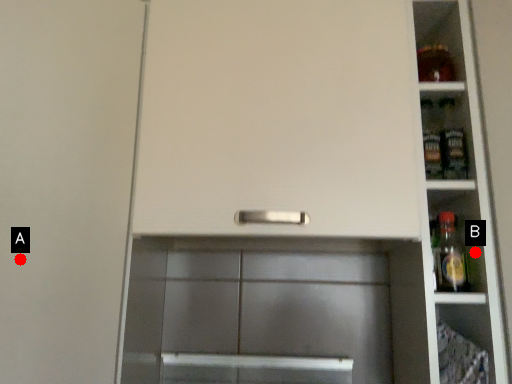
Question: Two points are circled on the image, labeled by A and B beside each circle. Which of the following is the farthest from the observer?

Choices:
 (A) A is further
 (B) B is further

Answer: (B)